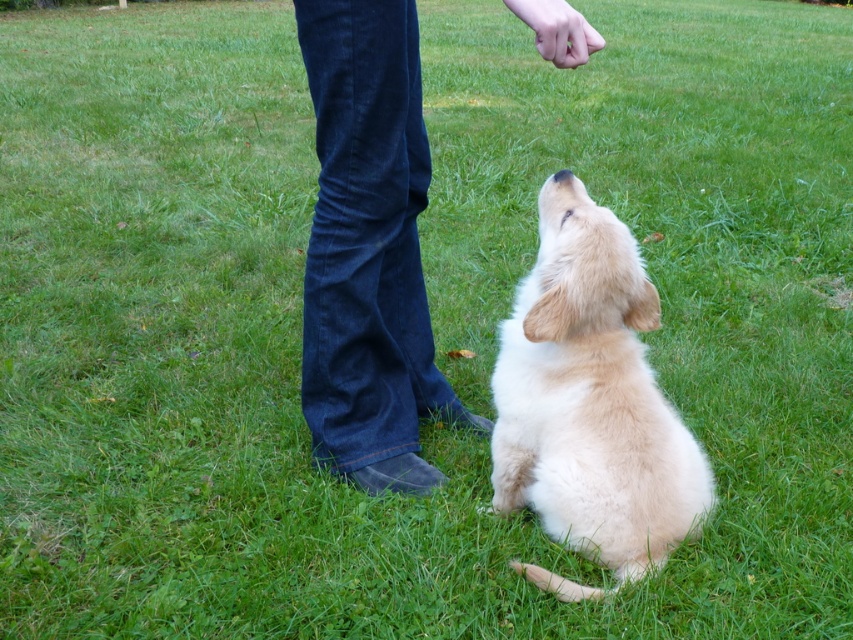
Question: Which of the following is the farthest from the observer?

Choices:
 (A) denim jeans at center
 (B) soft golden fur at center

Answer: (A)

Question: Is denim jeans at center wider than soft golden fur at center?

Choices:
 (A) no
 (B) yes

Answer: (A)

Question: Which object appears closest to the camera in this image?

Choices:
 (A) denim jeans at center
 (B) soft golden fur at center

Answer: (B)

Question: Can you confirm if denim jeans at center is positioned to the right of soft golden fur at center?

Choices:
 (A) no
 (B) yes

Answer: (A)

Question: Is denim jeans at center further to the viewer compared to soft golden fur at center?

Choices:
 (A) yes
 (B) no

Answer: (A)

Question: Among these points, which one is farthest from the camera?

Choices:
 (A) (550, 193)
 (B) (328, 291)

Answer: (B)